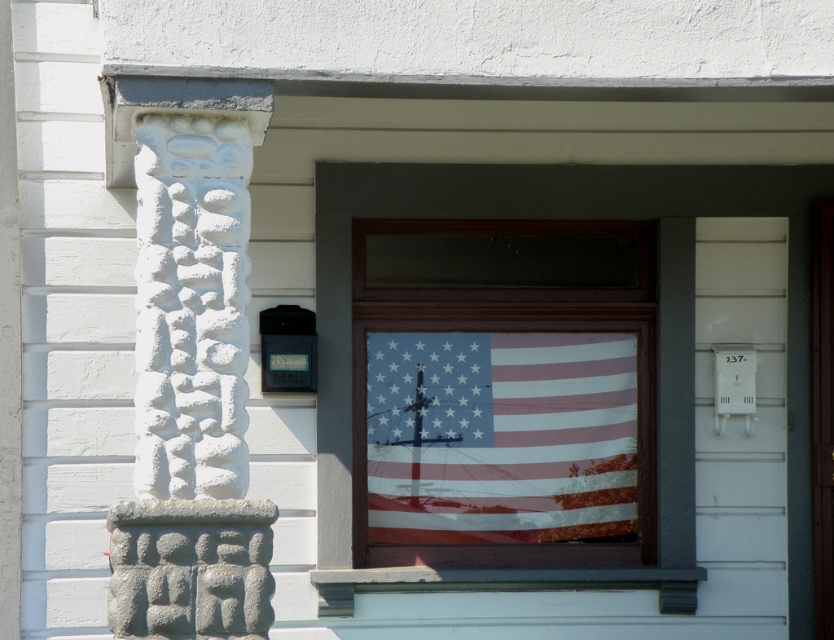
What are the coordinates of `white stone carving at left` in the screenshot? It's located at (191, 369).

Is white stone carving at left below american flag at center?

Actually, white stone carving at left is above american flag at center.

Who is more forward, (142, 324) or (481, 588)?

Point (142, 324)

In order to click on white stone carving at left in this screenshot , I will do `click(191, 369)`.

Which is below, matte paper flag at center or american flag at center?

Positioned lower is matte paper flag at center.

Between point (471, 480) and point (691, 317), which one is positioned behind?

Positioned behind is point (471, 480).

Find the location of a particular element. The width and height of the screenshot is (834, 640). matte paper flag at center is located at coordinates (500, 436).

Between white stone carving at left and matte paper flag at center, which one appears on the right side from the viewer's perspective?

matte paper flag at center

Is white stone carving at left taller than matte paper flag at center?

Indeed, white stone carving at left has a greater height compared to matte paper flag at center.

Measure the distance between point (194, 308) and camera.

Point (194, 308) and camera are 21.65 feet apart from each other.

Where is `white stone carving at left`? white stone carving at left is located at coordinates (191, 369).